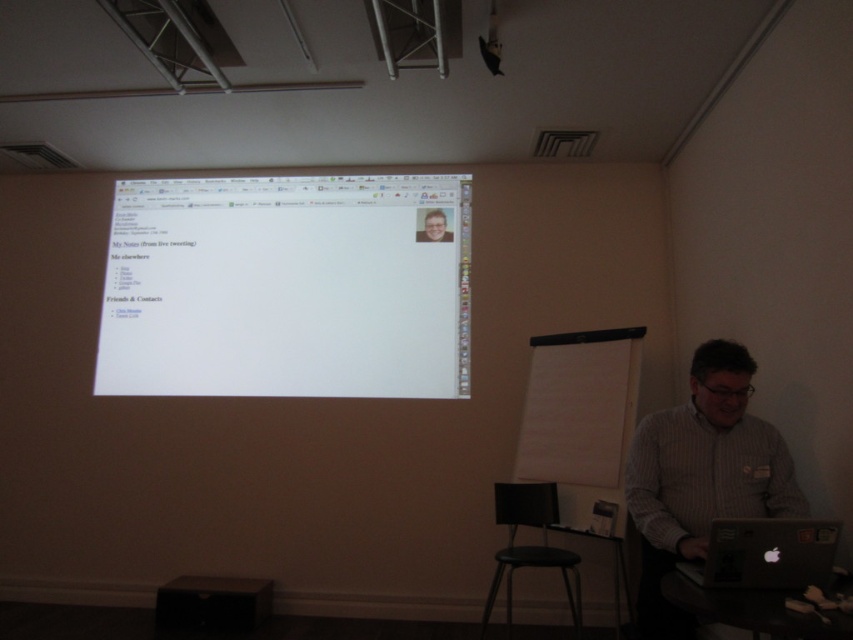
Question: Does silver metallic laptop at lower right have a smaller size compared to light brown wooden desk at center?

Choices:
 (A) no
 (B) yes

Answer: (A)

Question: Which object is closer to the camera taking this photo?

Choices:
 (A) white glossy screen at upper center
 (B) light brown wooden desk at center

Answer: (A)

Question: Which is nearer to the white shirt at lower right?

Choices:
 (A) black plastic stool at lower center
 (B) silver metallic laptop at lower right
 (C) light brown wooden desk at center

Answer: (B)

Question: Does white glossy screen at upper center come behind black plastic stool at lower center?

Choices:
 (A) no
 (B) yes

Answer: (B)

Question: Does white glossy screen at upper center come behind white shirt at lower right?

Choices:
 (A) yes
 (B) no

Answer: (A)

Question: Based on their relative distances, which object is nearer to the white glossy screen at upper center?

Choices:
 (A) white shirt at lower right
 (B) silver metallic laptop at lower right
 (C) black plastic stool at lower center
 (D) light brown wooden desk at center

Answer: (D)